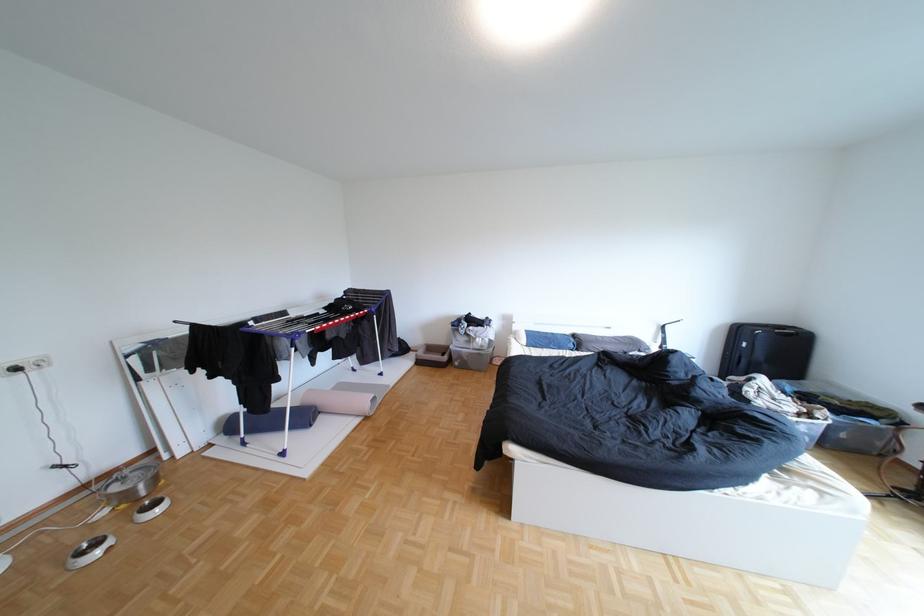
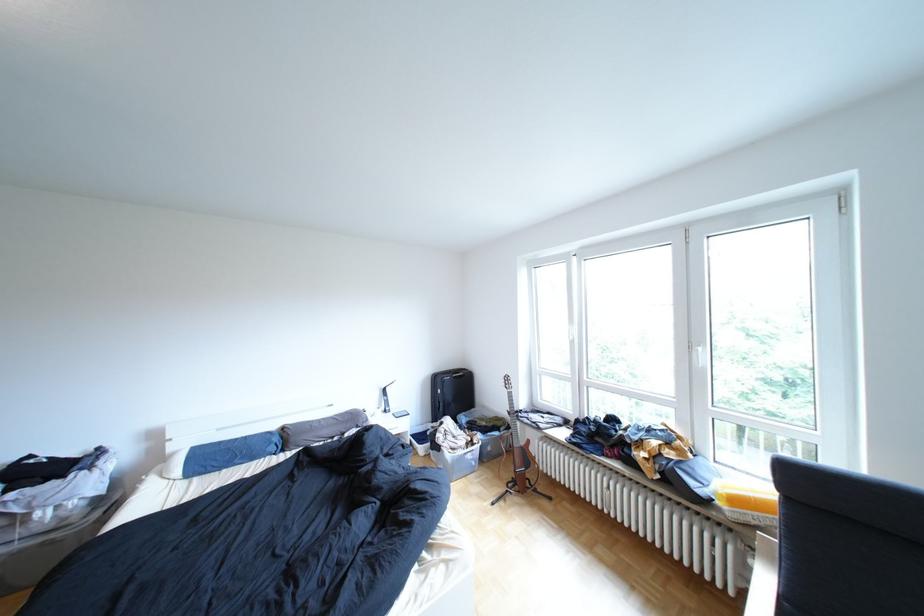
In the second image, find the point that corresponds to point (754, 331) in the first image.

(452, 379)